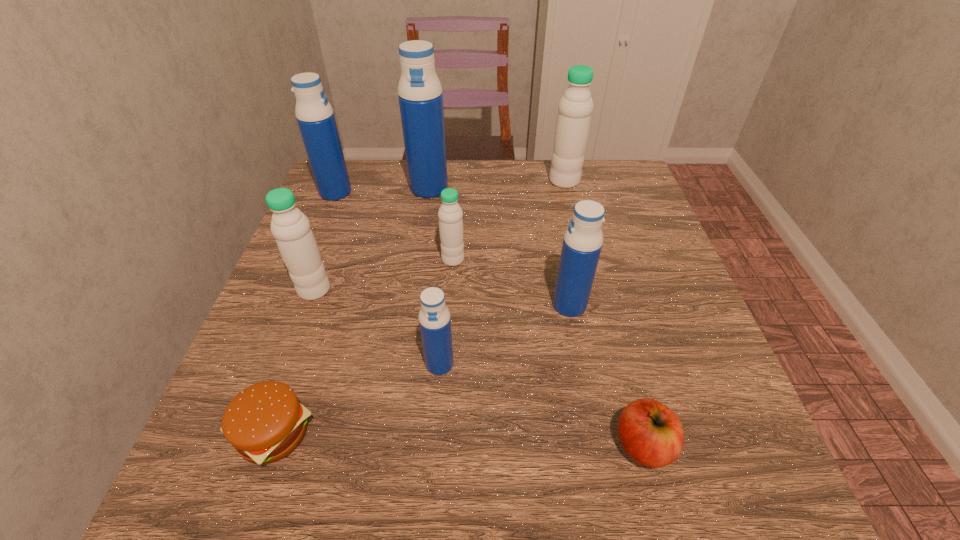
This screenshot has width=960, height=540. Find the location of `object at the near left corner`. object at the near left corner is located at coordinates (265, 422).

The image size is (960, 540). Find the location of `object that is at the far right corner`. object that is at the far right corner is located at coordinates (575, 107).

I want to click on object that is at the near right corner, so click(652, 434).

At what (x,y) coordinates should I click in order to perform the action: click on vacant space at the far edge of the desktop. Please return your answer as a coordinate pair (x, y). The height and width of the screenshot is (540, 960). Looking at the image, I should click on (525, 166).

This screenshot has width=960, height=540. I want to click on vacant space at the near edge of the desktop, so click(x=353, y=495).

This screenshot has height=540, width=960. In the image, there is a desktop. In order to click on vacant space at the left edge in this screenshot , I will do `click(338, 230)`.

This screenshot has height=540, width=960. In order to click on free region at the right edge of the desktop in this screenshot , I will do `click(661, 280)`.

In the image, there is a desktop. At what (x,y) coordinates should I click in order to perform the action: click on blank space at the near left corner. Please return your answer as a coordinate pair (x, y). This screenshot has height=540, width=960. Looking at the image, I should click on (244, 499).

This screenshot has height=540, width=960. I want to click on blank space at the far right corner of the desktop, so click(634, 205).

Image resolution: width=960 pixels, height=540 pixels. In order to click on free spot between the shortest object and the second biggest blue water bottle in this screenshot , I will do `click(304, 313)`.